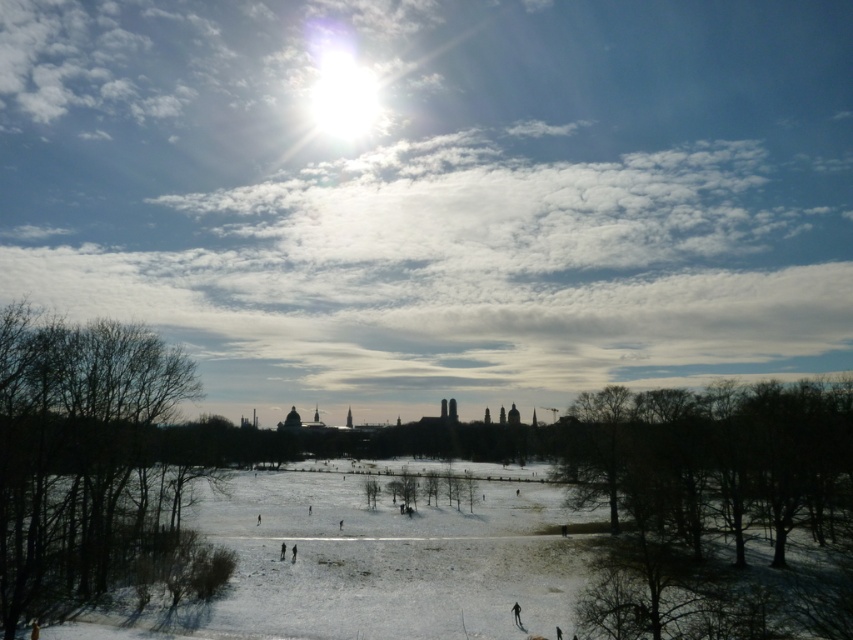
Can you confirm if brown leafless tree at lower right is wider than bare branches at left?

Correct, the width of brown leafless tree at lower right exceeds that of bare branches at left.

I want to click on brown leafless tree at lower right, so click(x=720, y=509).

Is point (728, 547) positioned behind point (70, 595)?

Yes, it is.

Locate an element on the screen. brown leafless tree at lower right is located at coordinates (720, 509).

Can you confirm if bright white clouds at upper center is wider than brown leafless tree at lower right?

Correct, the width of bright white clouds at upper center exceeds that of brown leafless tree at lower right.

Who is positioned more to the left, bright white clouds at upper center or brown leafless tree at lower right?

Positioned to the left is bright white clouds at upper center.

Where is `bright white clouds at upper center`? The image size is (853, 640). bright white clouds at upper center is located at coordinates (437, 193).

Who is taller, bright white clouds at upper center or bare branches at left?

With more height is bright white clouds at upper center.

Describe the element at coordinates (437, 193) in the screenshot. I see `bright white clouds at upper center` at that location.

Who is more distant from viewer, (131,170) or (30,502)?

Positioned behind is point (131,170).

Where is `bright white clouds at upper center`? The width and height of the screenshot is (853, 640). bright white clouds at upper center is located at coordinates (437, 193).